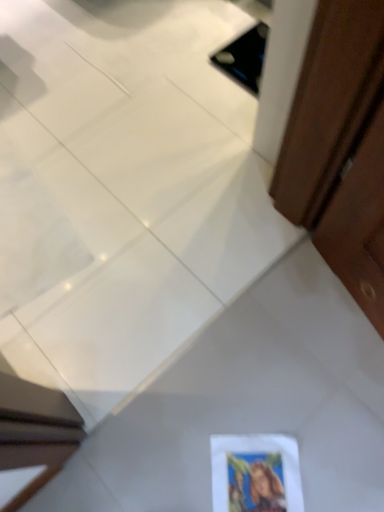
You are a GUI agent. You are given a task and a screenshot of the screen. Output one action in this format:
    pyautogui.click(x=<x>, y=<y>)
    Task: Click on the vacant area that lies to the right of white paper postcard at lower center
    
    Given the screenshot: What is the action you would take?
    pyautogui.click(x=340, y=458)